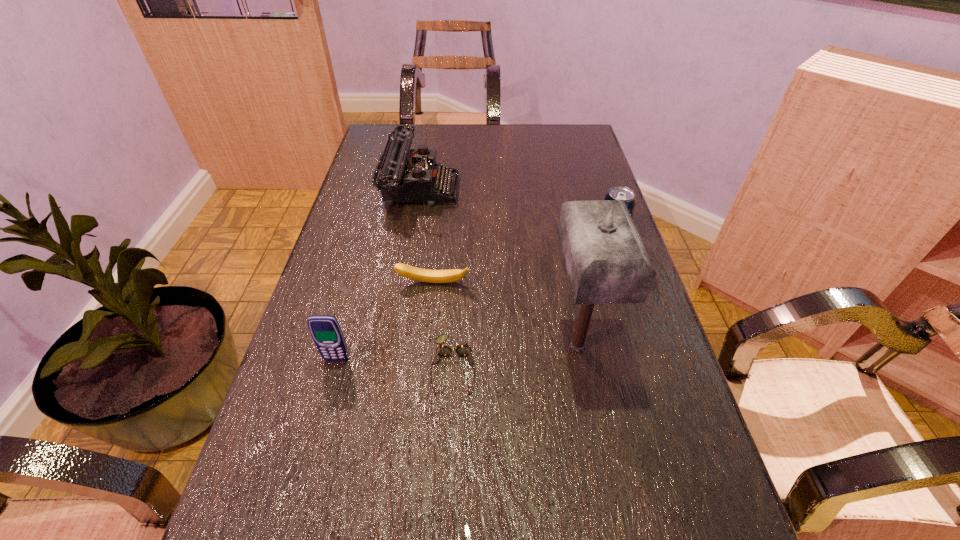
What are the coordinates of `the second object from right to left` in the screenshot? It's located at (606, 261).

Identify the location of the tallest object. (606, 261).

I want to click on typewriter, so click(x=401, y=176).

I want to click on the rightmost object, so click(x=622, y=193).

This screenshot has width=960, height=540. I want to click on the second farthest object, so click(622, 193).

You are a GUI agent. You are given a task and a screenshot of the screen. Output one action in this format:
    pyautogui.click(x=<x>, y=<y>)
    Task: Click on the cellular telephone
    
    Given the screenshot: What is the action you would take?
    pyautogui.click(x=325, y=330)

Find the location of a particular element. This screenshot has width=960, height=540. banana is located at coordinates (424, 275).

Where is `the third farthest object`? The image size is (960, 540). the third farthest object is located at coordinates (424, 275).

Where is `spectacles`? spectacles is located at coordinates (464, 349).

The width and height of the screenshot is (960, 540). Identify the location of free space located on the left of the mallet. (439, 346).